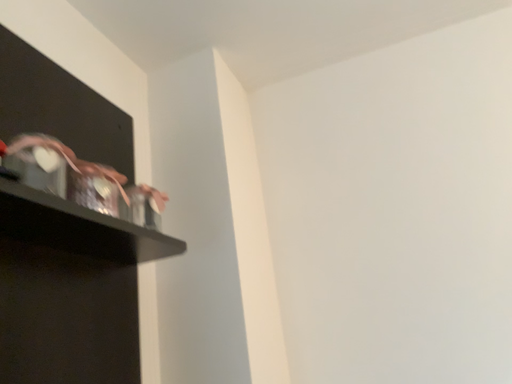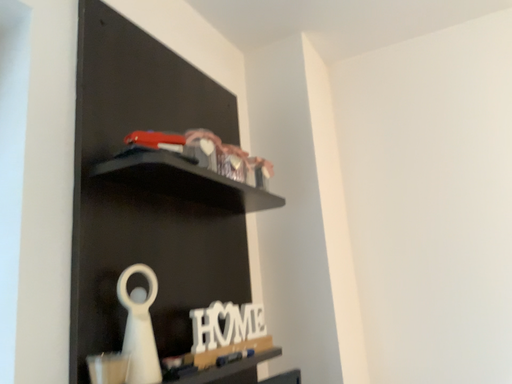
Question: How did the camera likely rotate when shooting the video?

Choices:
 (A) rotated downward
 (B) rotated upward

Answer: (A)